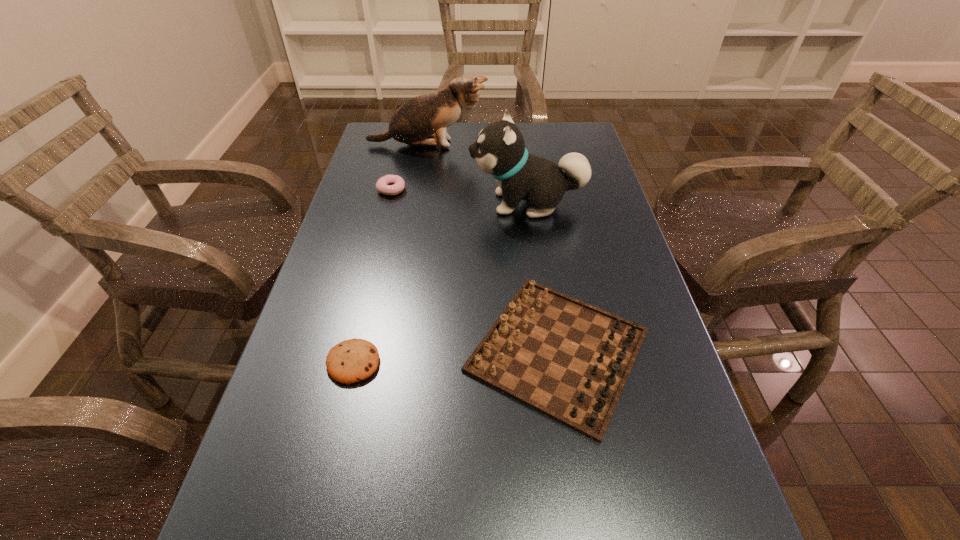
Where is `puppy`? puppy is located at coordinates [x=499, y=150].

Where is `cat`? The image size is (960, 540). cat is located at coordinates (415, 122).

Image resolution: width=960 pixels, height=540 pixels. Find the location of `the third tallest object`. the third tallest object is located at coordinates (567, 359).

Locate an element on the screen. This screenshot has height=540, width=960. doughnut is located at coordinates (389, 184).

In order to click on the shortest object in this screenshot , I will do `click(353, 360)`.

Identify the location of vacant area situated 0.280m at the face of the puppy. (367, 203).

At what (x,y) coordinates should I click in order to perform the action: click on vacant region located 0.110m at the face of the puppy. Please return your answer as a coordinate pair (x, y). Looking at the image, I should click on (429, 203).

This screenshot has height=540, width=960. I want to click on free space located 0.280m at the face of the puppy, so click(x=367, y=203).

Locate an element on the screen. The height and width of the screenshot is (540, 960). vacant space situated at the face of the farthest object is located at coordinates (515, 145).

At what (x,y) coordinates should I click in order to perform the action: click on vacant space located 0.330m on the back of the chessboard. Please return your answer as a coordinate pair (x, y). This screenshot has width=960, height=540. Looking at the image, I should click on (535, 197).